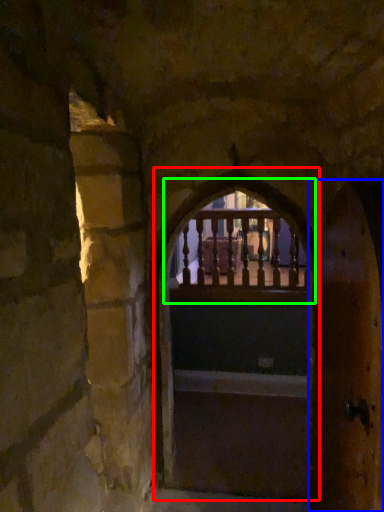
Question: Based on their relative distances, which object is nearer to archway (highlighted by a red box)? Choose from door (highlighted by a blue box) and window (highlighted by a green box).

Choices:
 (A) door
 (B) window

Answer: (B)